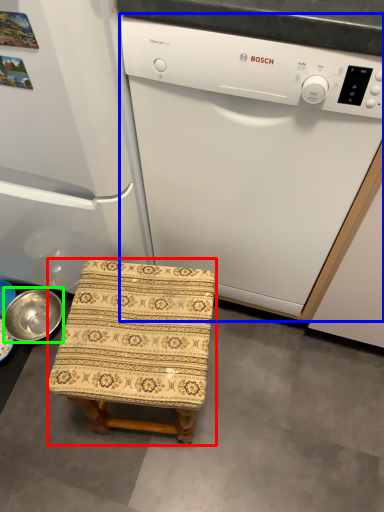
Question: Estimate the real-world distances between objects in this image. Which object is closer to furniture (highlighted by a red box), home appliance (highlighted by a blue box) or basin (highlighted by a green box)?

Choices:
 (A) home appliance
 (B) basin

Answer: (A)